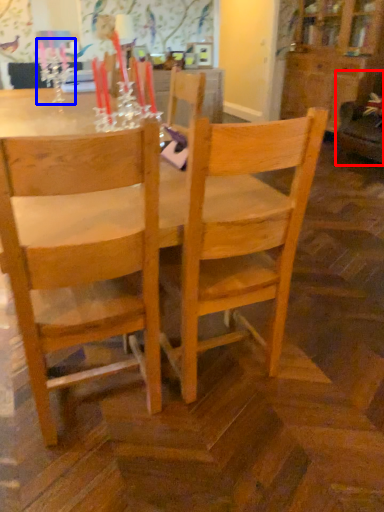
Question: Which object appears closest to the camera in this image, swivel chair (highlighted by a red box) or candle holder (highlighted by a blue box)?

Choices:
 (A) swivel chair
 (B) candle holder

Answer: (B)